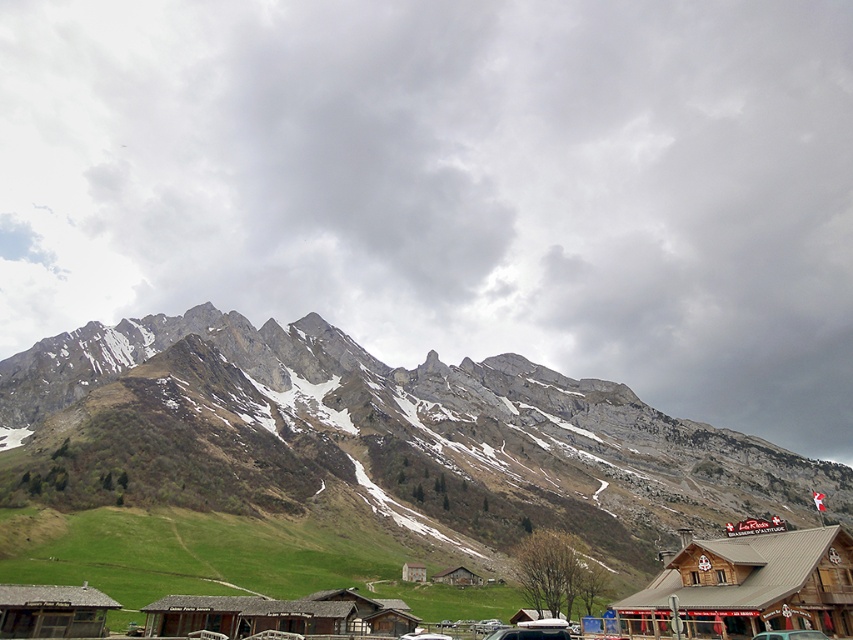
You are standing at the point marked by the coordinate point at point [750,586]. Which object are you standing on?

You are standing on the brown wooden hut at lower right.

You are a hiker standing in the valley between the mountains. You see the cloudy gray sky at upper center and the brown wooden hut at lower right. Which object is closer to you?

The brown wooden hut at lower right is closer to you because it is positioned behind the cloudy gray sky at upper center, which means the sky is in the foreground and the hut is further back in the scene.

You are standing in the mountain village and want to take a photo of the cloudy gray sky at upper center. What are the coordinates where you should point your camera?

The cloudy gray sky at upper center is located at coordinates point (453,186).